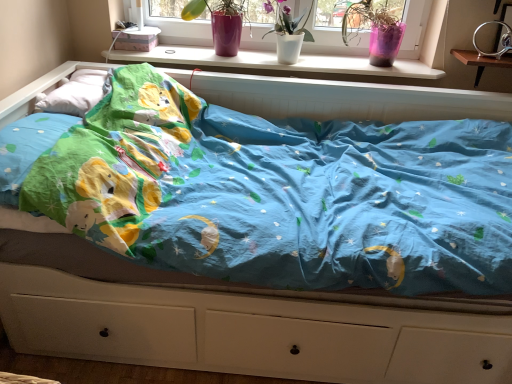
Question: Does point (471, 57) appear closer or farther from the camera than point (268, 62)?

Choices:
 (A) farther
 (B) closer

Answer: (B)

Question: In the image, is wooden changing table at upper right positioned in front of or behind white plastic window sill at upper center?

Choices:
 (A) behind
 (B) front

Answer: (B)

Question: Estimate the real-world distances between objects in this image. Which object is closer to the white plastic window sill at upper center?

Choices:
 (A) pink plastic pot at upper right, which is the first floral arrangement from right to left
 (B) white matte vase at upper center, arranged as the 2th floral arrangement when viewed from the left
 (C) wooden changing table at upper right
 (D) white soft pillow at upper left
 (E) matte pink vase at upper center, the third floral arrangement from the right

Answer: (E)

Question: Which object is the farthest from the white soft pillow at upper left?

Choices:
 (A) pink plastic pot at upper right, which is the first floral arrangement from right to left
 (B) white plastic window sill at upper center
 (C) white matte vase at upper center, which is counted as the 2th floral arrangement, starting from the right
 (D) matte pink vase at upper center, arranged as the first floral arrangement when viewed from the left
 (E) wooden changing table at upper right

Answer: (E)